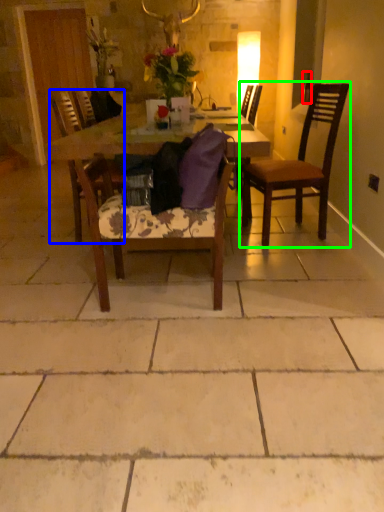
Question: Considering the real-world distances, which object is closest to bottle (highlighted by a red box)? chair (highlighted by a blue box) or chair (highlighted by a green box).

Choices:
 (A) chair
 (B) chair

Answer: (B)